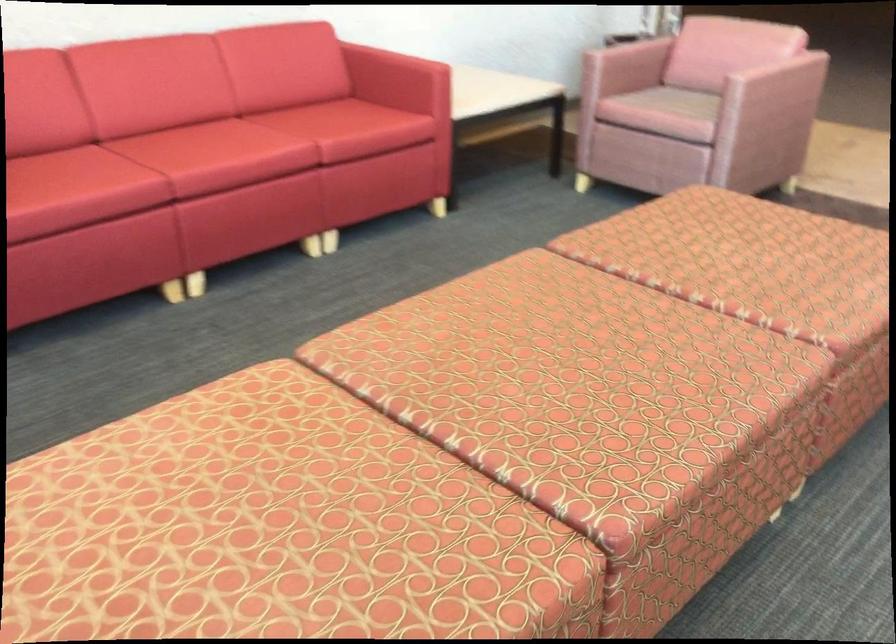
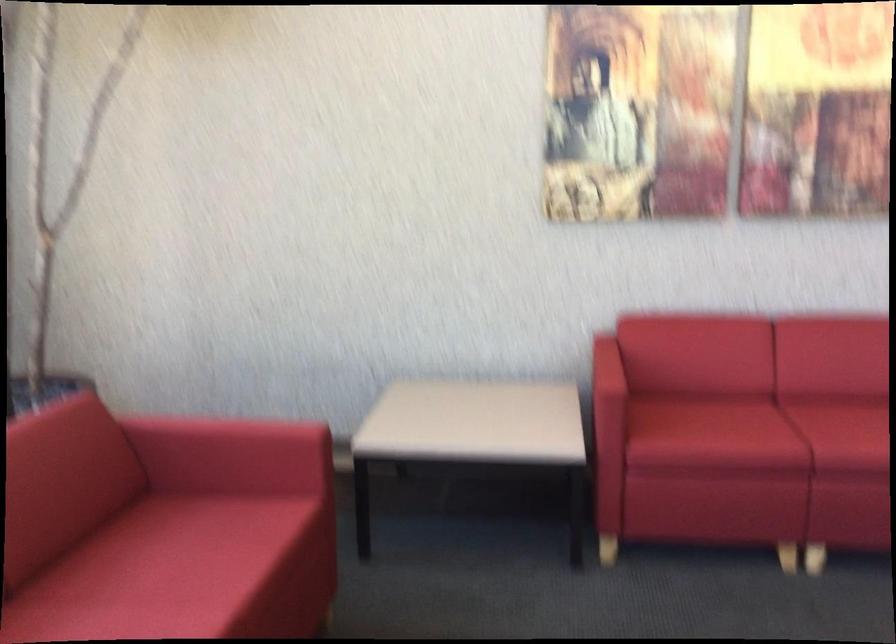
Question: The images are taken continuously from a first-person perspective. In which direction is your viewpoint rotating?

Choices:
 (A) Left
 (B) Right
 (C) Up
 (D) Down

Answer: (A)